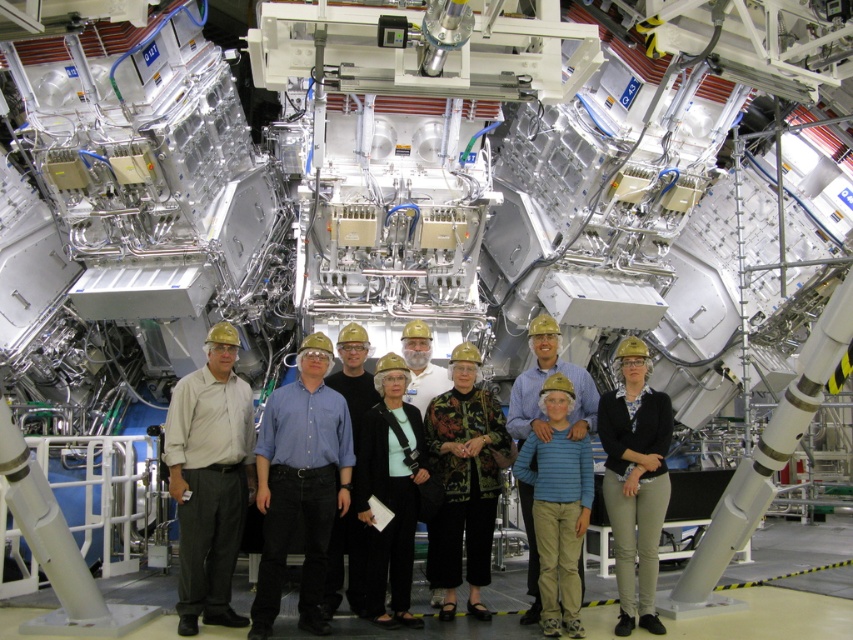
Can you confirm if black matte jacket at center is smaller than black fabric jacket at center?

Indeed, black matte jacket at center has a smaller size compared to black fabric jacket at center.

Is the position of black matte jacket at center less distant than that of black fabric jacket at center?

Yes, black matte jacket at center is closer to the viewer.

Identify the location of black matte jacket at center. (635, 481).

Between point (498, 470) and point (656, 417), which one is positioned in front?

Positioned in front is point (656, 417).

Which of these two, floral-patterned sweater at center or black matte jacket at center, stands taller?

With more height is floral-patterned sweater at center.

I want to click on floral-patterned sweater at center, so coord(463,481).

Who is more forward, (445, 480) or (433, 449)?

Point (445, 480) is more forward.

Who is shorter, floral-patterned sweater at center or black hard hat at center?

Standing shorter between the two is floral-patterned sweater at center.

I want to click on floral-patterned sweater at center, so click(x=463, y=481).